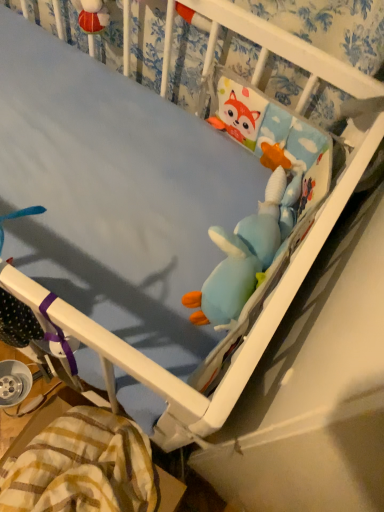
Identify the location of blue plush toy at center, the 1th toy in the bottom-to-top sequence. (245, 254).

How much space does soft plush toy at upper right, which ranks as the first toy in top-to-bottom order, occupy vertically?

soft plush toy at upper right, which ranks as the first toy in top-to-bottom order, is 2.85 inches tall.

Locate an element on the screen. The width and height of the screenshot is (384, 512). yellow plaid blanket at lower left is located at coordinates (82, 467).

Which of these two, yellow plaid blanket at lower left or soft plush toy at upper right, which ranks as the first toy in top-to-bottom order, is bigger?

Bigger between the two is yellow plaid blanket at lower left.

In the image, is yellow plaid blanket at lower left positioned in front of or behind soft plush toy at upper right, acting as the 2th toy starting from the bottom?

Clearly, yellow plaid blanket at lower left is in front of soft plush toy at upper right, acting as the 2th toy starting from the bottom.

Do you think yellow plaid blanket at lower left is within soft plush toy at upper right, which ranks as the first toy in top-to-bottom order, or outside of it?

yellow plaid blanket at lower left cannot be found inside soft plush toy at upper right, which ranks as the first toy in top-to-bottom order.

Is yellow plaid blanket at lower left to the left or to the right of blue plush toy at center, the 1th toy in the bottom-to-top sequence, in the image?

In the image, yellow plaid blanket at lower left appears on the left side of blue plush toy at center, the 1th toy in the bottom-to-top sequence.

Is yellow plaid blanket at lower left further to camera compared to blue plush toy at center, which is counted as the second toy, starting from the top?

Yes, it is behind blue plush toy at center, which is counted as the second toy, starting from the top.

Is yellow plaid blanket at lower left wider or thinner than blue plush toy at center, which is counted as the second toy, starting from the top?

yellow plaid blanket at lower left is wider than blue plush toy at center, which is counted as the second toy, starting from the top.

Can you confirm if yellow plaid blanket at lower left is smaller than blue plush toy at center, which is counted as the second toy, starting from the top?

No.

Which object is more forward, blue plush toy at center, which is counted as the second toy, starting from the top, or yellow plaid blanket at lower left?

Positioned in front is blue plush toy at center, which is counted as the second toy, starting from the top.

Who is smaller, blue plush toy at center, the 1th toy in the bottom-to-top sequence, or yellow plaid blanket at lower left?

blue plush toy at center, the 1th toy in the bottom-to-top sequence, is smaller.

Does point (226, 292) appear closer or farther from the camera than point (15, 467)?

Clearly, point (226, 292) is closer to the camera than point (15, 467).

Which is more to the left, soft plush toy at upper right, which ranks as the first toy in top-to-bottom order, or yellow plaid blanket at lower left?

From the viewer's perspective, yellow plaid blanket at lower left appears more on the left side.

Does point (282, 219) lie behind point (142, 458)?

That is False.

From a real-world perspective, which is physically below, soft plush toy at upper right, which ranks as the first toy in top-to-bottom order, or yellow plaid blanket at lower left?

yellow plaid blanket at lower left, from a real-world perspective.

Looking at this image, is blue plush toy at center, which is counted as the second toy, starting from the top, at the back of soft plush toy at upper right, acting as the 2th toy starting from the bottom?

soft plush toy at upper right, acting as the 2th toy starting from the bottom, does not have its back to blue plush toy at center, which is counted as the second toy, starting from the top.

Does soft plush toy at upper right, acting as the 2th toy starting from the bottom, have a larger size compared to blue plush toy at center, the 1th toy in the bottom-to-top sequence?

No.

From the picture: From a real-world perspective, is soft plush toy at upper right, acting as the 2th toy starting from the bottom, above or below blue plush toy at center, the 1th toy in the bottom-to-top sequence?

Clearly, from a real-world perspective, soft plush toy at upper right, acting as the 2th toy starting from the bottom, is below blue plush toy at center, the 1th toy in the bottom-to-top sequence.

Find the location of a particular element. toy above the soft plush toy at upper right, which ranks as the first toy in top-to-bottom order (from a real-world perspective) is located at coordinates (245, 254).

Is blue plush toy at center, which is counted as the second toy, starting from the top, placed right next to soft plush toy at upper right, acting as the 2th toy starting from the bottom?

Indeed, blue plush toy at center, which is counted as the second toy, starting from the top, and soft plush toy at upper right, acting as the 2th toy starting from the bottom, are beside each other and touching.

Is blue plush toy at center, the 1th toy in the bottom-to-top sequence, not inside soft plush toy at upper right, which ranks as the first toy in top-to-bottom order?

Yes, blue plush toy at center, the 1th toy in the bottom-to-top sequence, is not within soft plush toy at upper right, which ranks as the first toy in top-to-bottom order.

From the image's perspective, which one is positioned lower, blue plush toy at center, the 1th toy in the bottom-to-top sequence, or soft plush toy at upper right, acting as the 2th toy starting from the bottom?

blue plush toy at center, the 1th toy in the bottom-to-top sequence, from the image's perspective.

Does point (271, 208) appear closer or farther from the camera than point (273, 200)?

Point (271, 208).

You are a GUI agent. You are given a task and a screenshot of the screen. Output one action in this format:
    pyautogui.click(x=<x>, y=<y>)
    Task: Click on the 2nd toy positioned above the yellow plaid blanket at lower left (from the image's perspective)
    The width and height of the screenshot is (384, 512).
    Given the screenshot: What is the action you would take?
    click(x=282, y=183)

Locate an element on the screen. The width and height of the screenshot is (384, 512). the 1st toy to the right of the yellow plaid blanket at lower left, starting your count from the anchor is located at coordinates (245, 254).

Looking at the image, which one is located closer to blue plush toy at center, the 1th toy in the bottom-to-top sequence, soft plush toy at upper right, which ranks as the first toy in top-to-bottom order, or yellow plaid blanket at lower left?

soft plush toy at upper right, which ranks as the first toy in top-to-bottom order.

When comparing their distances from blue plush toy at center, the 1th toy in the bottom-to-top sequence, does yellow plaid blanket at lower left or soft plush toy at upper right, acting as the 2th toy starting from the bottom, seem closer?

Among the two, soft plush toy at upper right, acting as the 2th toy starting from the bottom, is located nearer to blue plush toy at center, the 1th toy in the bottom-to-top sequence.

When comparing their distances from yellow plaid blanket at lower left, does soft plush toy at upper right, acting as the 2th toy starting from the bottom, or blue plush toy at center, the 1th toy in the bottom-to-top sequence, seem closer?

The object closer to yellow plaid blanket at lower left is blue plush toy at center, the 1th toy in the bottom-to-top sequence.

Considering their positions, is blue plush toy at center, which is counted as the second toy, starting from the top, positioned closer to soft plush toy at upper right, which ranks as the first toy in top-to-bottom order, than yellow plaid blanket at lower left?

The object closer to soft plush toy at upper right, which ranks as the first toy in top-to-bottom order, is blue plush toy at center, which is counted as the second toy, starting from the top.

Which object lies nearer to the anchor point yellow plaid blanket at lower left, blue plush toy at center, which is counted as the second toy, starting from the top, or soft plush toy at upper right, which ranks as the first toy in top-to-bottom order?

blue plush toy at center, which is counted as the second toy, starting from the top.

When comparing their distances from soft plush toy at upper right, acting as the 2th toy starting from the bottom, does yellow plaid blanket at lower left or blue plush toy at center, which is counted as the second toy, starting from the top, seem further?

yellow plaid blanket at lower left is positioned further to the anchor soft plush toy at upper right, acting as the 2th toy starting from the bottom.

At what (x,y) coordinates should I click in order to perform the action: click on toy between soft plush toy at upper right, which ranks as the first toy in top-to-bottom order, and yellow plaid blanket at lower left, in the vertical direction. Please return your answer as a coordinate pair (x, y). Looking at the image, I should click on (245, 254).